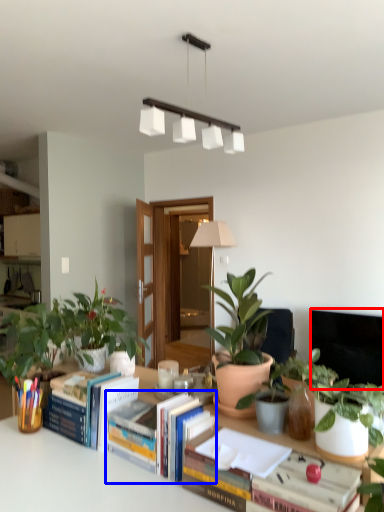
Question: Which object appears closest to the camera in this image, television (highlighted by a red box) or book (highlighted by a blue box)?

Choices:
 (A) television
 (B) book

Answer: (B)